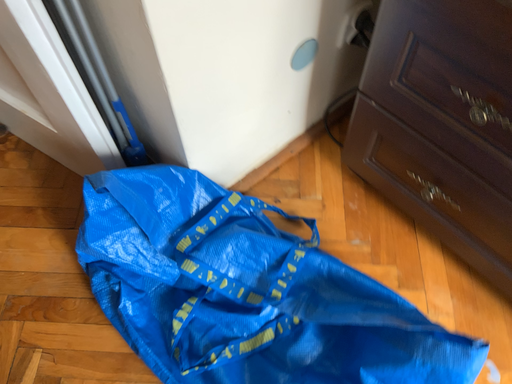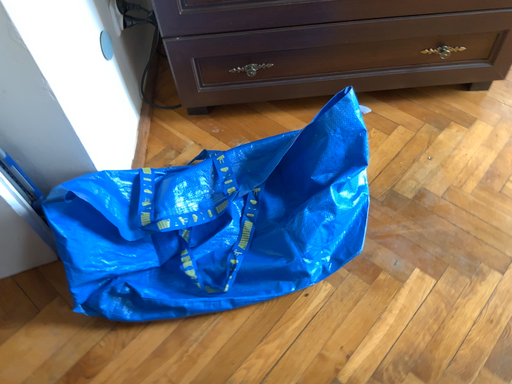
Question: How did the camera likely rotate when shooting the video?

Choices:
 (A) rotated upward
 (B) rotated downward

Answer: (A)